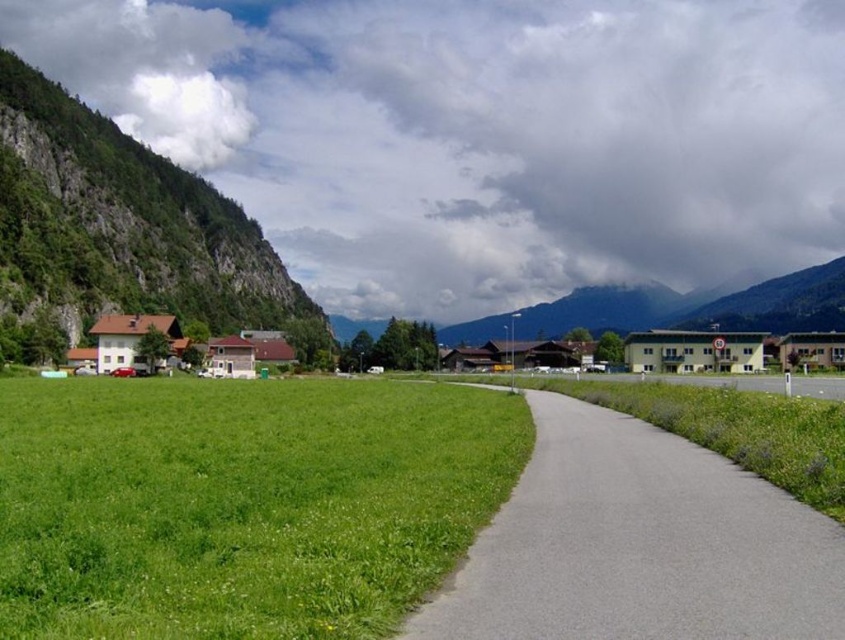
Who is more forward, (x=101, y=138) or (x=113, y=342)?

Point (x=113, y=342) is in front.

Can you confirm if green rocky mountain at left is wider than brown wooden house at left?

Yes, green rocky mountain at left is wider than brown wooden house at left.

Who is more forward, [194,240] or [75,348]?

Positioned in front is point [75,348].

The image size is (845, 640). Identify the location of green rocky mountain at left. (124, 230).

Is point (695, 500) behind point (135, 227)?

No, it is in front of (135, 227).

Does gray asphalt path at center have a smaller size compared to green rocky mountain at left?

Correct, gray asphalt path at center occupies less space than green rocky mountain at left.

Is point (625, 442) more distant than point (63, 188)?

No, (625, 442) is in front of (63, 188).

Locate an element on the screen. gray asphalt path at center is located at coordinates (638, 545).

Who is more forward, (488, 632) or (155, 326)?

Positioned in front is point (488, 632).

Which of these two, gray asphalt path at center or brown wooden house at left, stands shorter?

gray asphalt path at center is shorter.

In order to click on gray asphalt path at center in this screenshot , I will do `click(638, 545)`.